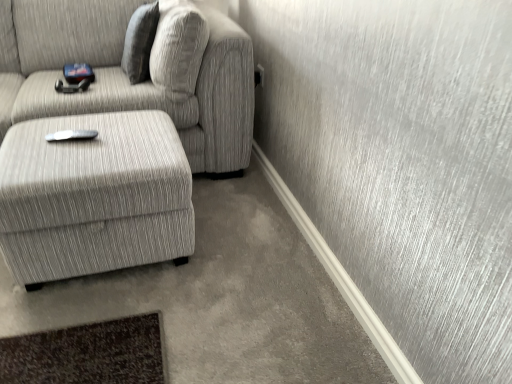
Question: Is textured gray fabric couch at left at the left side of textured gray pillow at upper center?

Choices:
 (A) yes
 (B) no

Answer: (A)

Question: From a real-world perspective, does textured gray fabric couch at left sit lower than textured gray pillow at upper center?

Choices:
 (A) yes
 (B) no

Answer: (A)

Question: Are textured gray fabric couch at left and textured gray pillow at upper center beside each other?

Choices:
 (A) yes
 (B) no

Answer: (B)

Question: Is textured gray fabric couch at left at the right side of textured gray pillow at upper center?

Choices:
 (A) no
 (B) yes

Answer: (A)

Question: Is textured gray pillow at upper center at the back of textured gray fabric couch at left?

Choices:
 (A) no
 (B) yes

Answer: (B)

Question: From the image's perspective, is textured gray pillow at upper center positioned above or below textured gray ottoman at lower left?

Choices:
 (A) above
 (B) below

Answer: (A)

Question: From a real-world perspective, is textured gray pillow at upper center physically located above or below textured gray ottoman at lower left?

Choices:
 (A) above
 (B) below

Answer: (A)

Question: Is textured gray pillow at upper center to the left or to the right of textured gray ottoman at lower left in the image?

Choices:
 (A) left
 (B) right

Answer: (B)

Question: Is textured gray pillow at upper center situated inside textured gray ottoman at lower left or outside?

Choices:
 (A) inside
 (B) outside

Answer: (B)

Question: Looking at their shapes, would you say textured gray pillow at upper center is wider or thinner than textured gray fabric couch at left?

Choices:
 (A) thin
 (B) wide

Answer: (A)

Question: Is textured gray pillow at upper center inside the boundaries of textured gray fabric couch at left, or outside?

Choices:
 (A) outside
 (B) inside

Answer: (B)

Question: From the image's perspective, is textured gray pillow at upper center above or below textured gray fabric couch at left?

Choices:
 (A) above
 (B) below

Answer: (A)

Question: From a real-world perspective, is textured gray pillow at upper center physically located above or below textured gray fabric couch at left?

Choices:
 (A) below
 (B) above

Answer: (B)

Question: Considering the positions of textured gray fabric couch at left and textured gray pillow at upper center in the image, is textured gray fabric couch at left wider or thinner than textured gray pillow at upper center?

Choices:
 (A) thin
 (B) wide

Answer: (B)

Question: From the image's perspective, is textured gray fabric couch at left located above or below textured gray pillow at upper center?

Choices:
 (A) below
 (B) above

Answer: (A)